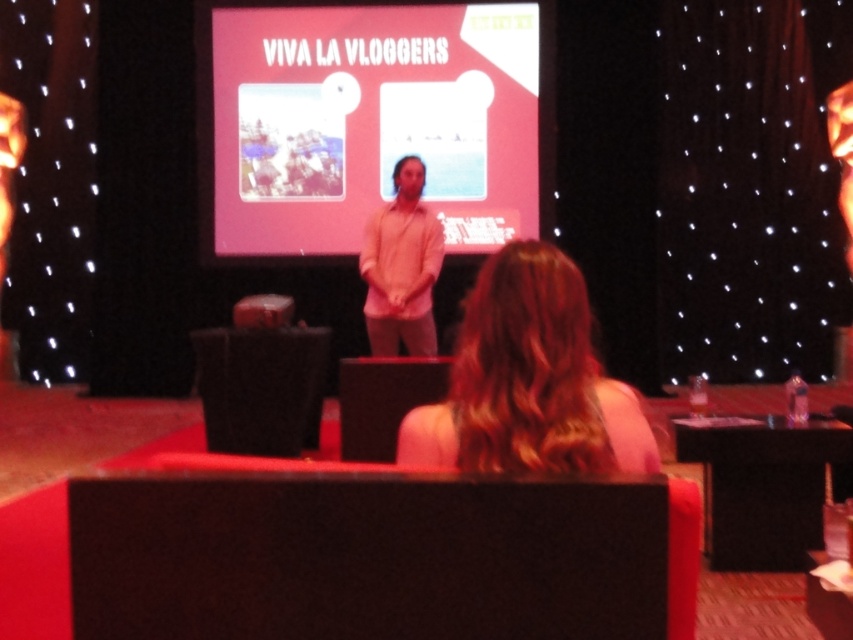
You are an event planner checking the stage setup. You need to ensure that the pink matte projection screen at center is visible to all attendees. Considering the height of the blonde hair at center, will the screen be visible over the speaker?

The pink matte projection screen at center is taller than the blonde hair at center, so yes, the screen will be visible over the speaker.

Based on the photo, you are an event planner setting up a conference room. You need to place a projector that will project onto the pink matte projection screen at center. The projector requires a clear line of sight to the screen. Given that the screen is located at point coordinates (372, 122), can you confirm if there are any objects in the foreground that might obstruct the projector beam to the pink matte projection screen at center?

The point coordinates (372, 122) correspond to the pink matte projection screen at center. The scene description mentions a seated audience member in the foreground, but since the screen is at center and the audience member is seated, there should be a clear line of sight from the projector to the screen unless the audience member is directly in front of it. However, the scene does not specify the exact positioning of the audience member relative to the screen coordinates. Therefore, it is possible that a